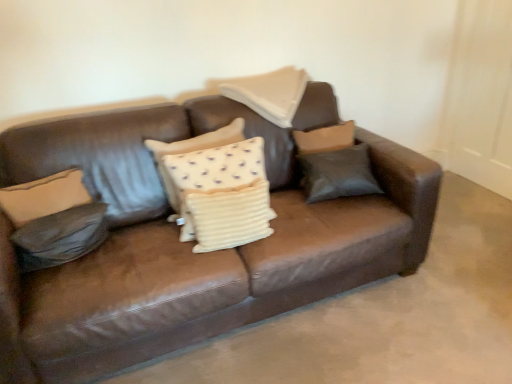
Question: Does white textured pillow at center, the fourth pillow from the right, contain brown leather couch at center?

Choices:
 (A) no
 (B) yes

Answer: (A)

Question: From a real-world perspective, is white textured pillow at center, the fourth pillow from the right, located beneath brown leather couch at center?

Choices:
 (A) yes
 (B) no

Answer: (B)

Question: Is white textured pillow at center, the fourth pillow from the right, next to brown leather couch at center?

Choices:
 (A) no
 (B) yes

Answer: (A)

Question: Is white textured pillow at center, the fourth pillow from the right, far away from brown leather couch at center?

Choices:
 (A) yes
 (B) no

Answer: (B)

Question: Is white textured pillow at center, positioned as the 2th pillow in left-to-right order, to the left of brown leather couch at center from the viewer's perspective?

Choices:
 (A) no
 (B) yes

Answer: (B)

Question: Based on their sizes in the image, would you say matte brown pillow at center, which ranks as the 1th pillow in right-to-left order, is bigger or smaller than leather pillow at left, which is counted as the first pillow, starting from the left?

Choices:
 (A) big
 (B) small

Answer: (A)

Question: From the image's perspective, is matte brown pillow at center, which ranks as the 1th pillow in right-to-left order, positioned above or below leather pillow at left, which ranks as the 5th pillow in right-to-left order?

Choices:
 (A) below
 (B) above

Answer: (B)

Question: In terms of width, does matte brown pillow at center, which ranks as the 1th pillow in right-to-left order, look wider or thinner when compared to leather pillow at left, which is counted as the first pillow, starting from the left?

Choices:
 (A) wide
 (B) thin

Answer: (B)

Question: In terms of height, does matte brown pillow at center, the fifth pillow from the left, look taller or shorter compared to leather pillow at left, which ranks as the 5th pillow in right-to-left order?

Choices:
 (A) short
 (B) tall

Answer: (B)

Question: Based on their sizes in the image, would you say beige fabric pillow at center, the 2th pillow when ordered from right to left, is bigger or smaller than matte brown pillow at center, which ranks as the 1th pillow in right-to-left order?

Choices:
 (A) small
 (B) big

Answer: (B)

Question: In terms of height, does beige fabric pillow at center, the 2th pillow when ordered from right to left, look taller or shorter compared to matte brown pillow at center, the fifth pillow from the left?

Choices:
 (A) tall
 (B) short

Answer: (B)

Question: Do you think beige fabric pillow at center, the 2th pillow when ordered from right to left, is within matte brown pillow at center, which ranks as the 1th pillow in right-to-left order, or outside of it?

Choices:
 (A) outside
 (B) inside

Answer: (A)

Question: Looking at their shapes, would you say beige fabric pillow at center, the 2th pillow when ordered from right to left, is wider or thinner than matte brown pillow at center, the fifth pillow from the left?

Choices:
 (A) wide
 (B) thin

Answer: (A)

Question: Is leather pillow at left, which is counted as the first pillow, starting from the left, wider or thinner than beige fabric pillow at center, the 4th pillow viewed from the left?

Choices:
 (A) wide
 (B) thin

Answer: (B)

Question: Is leather pillow at left, which is counted as the first pillow, starting from the left, taller or shorter than beige fabric pillow at center, the 4th pillow viewed from the left?

Choices:
 (A) tall
 (B) short

Answer: (B)